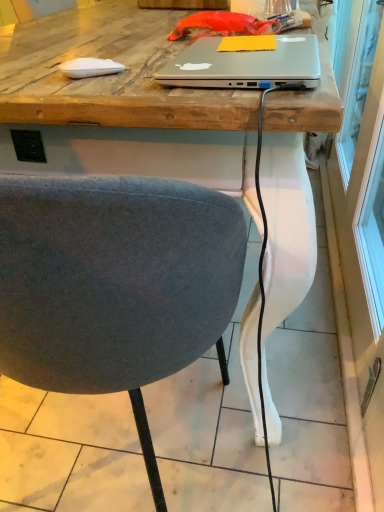
What is the approximate width of satin silver laptop at center?

The width of satin silver laptop at center is 9.12 inches.

Measure the distance between textured gray chair at center and camera.

They are 33.27 centimeters apart.

Locate an element on the screen. transparent glass screen door at right is located at coordinates (361, 234).

Can you confirm if satin silver laptop at center is smaller than transparent glass screen door at right?

Indeed, satin silver laptop at center has a smaller size compared to transparent glass screen door at right.

Does satin silver laptop at center touch transparent glass screen door at right?

No.

Considering the relative sizes of satin silver laptop at center and transparent glass screen door at right in the image provided, is satin silver laptop at center thinner than transparent glass screen door at right?

No.

Between transparent glass screen door at right and textured gray chair at center, which one has less height?

With less height is textured gray chair at center.

Which is farther, (x=368, y=317) or (x=89, y=211)?

Point (x=368, y=317)

Looking at their sizes, would you say textured gray chair at center is wider or thinner than transparent glass screen door at right?

Clearly, textured gray chair at center has more width compared to transparent glass screen door at right.

Considering the relative sizes of textured gray chair at center and transparent glass screen door at right in the image provided, is textured gray chair at center shorter than transparent glass screen door at right?

Indeed, textured gray chair at center has a lesser height compared to transparent glass screen door at right.

Which is behind, textured gray chair at center or transparent glass screen door at right?

transparent glass screen door at right is more distant.

From a real-world perspective, is textured gray chair at center above or below transparent glass screen door at right?

In terms of real-world spatial position, textured gray chair at center is below transparent glass screen door at right.

Is satin silver laptop at center not within textured gray chair at center?

No, most part of satin silver laptop at center lies within textured gray chair at center.

Does satin silver laptop at center come in front of textured gray chair at center?

No.

Consider the image. Is satin silver laptop at center taller or shorter than textured gray chair at center?

Clearly, satin silver laptop at center is shorter compared to textured gray chair at center.

From the image's perspective, which object appears higher, transparent glass screen door at right or satin silver laptop at center?

transparent glass screen door at right appears higher in the image.

Is transparent glass screen door at right far from satin silver laptop at center?

Actually, transparent glass screen door at right and satin silver laptop at center are a little close together.

Is transparent glass screen door at right wider than satin silver laptop at center?

In fact, transparent glass screen door at right might be narrower than satin silver laptop at center.

Considering the points (174, 364) and (248, 85), which point is in front, point (174, 364) or point (248, 85)?

Positioned in front is point (248, 85).

Is satin silver laptop at center a part of textured gray chair at center?

Yes, satin silver laptop at center is a part of textured gray chair at center.

Is textured gray chair at center behind satin silver laptop at center?

That is False.

Based on the photo, is textured gray chair at center looking in the opposite direction of satin silver laptop at center?

textured gray chair at center is not turned away from satin silver laptop at center.

At what (x,y) coordinates should I click in order to perform the action: click on laptop that appears above the transparent glass screen door at right (from a real-world perspective). Please return your answer as a coordinate pair (x, y). This screenshot has width=384, height=512. Looking at the image, I should click on (244, 65).

Locate an element on the screen. Image resolution: width=384 pixels, height=512 pixels. chair below the transparent glass screen door at right (from a real-world perspective) is located at coordinates (115, 285).

Estimate the real-world distances between objects in this image. Which object is closer to transparent glass screen door at right, textured gray chair at center or satin silver laptop at center?

textured gray chair at center.

Considering their positions, is satin silver laptop at center positioned further to textured gray chair at center than transparent glass screen door at right?

Among the two, transparent glass screen door at right is located further to textured gray chair at center.

Looking at the image, which one is located closer to textured gray chair at center, transparent glass screen door at right or satin silver laptop at center?

satin silver laptop at center is positioned closer to the anchor textured gray chair at center.

Which object lies nearer to the anchor point satin silver laptop at center, textured gray chair at center or transparent glass screen door at right?

Based on the image, textured gray chair at center appears to be nearer to satin silver laptop at center.

Looking at the image, which one is located closer to satin silver laptop at center, transparent glass screen door at right or textured gray chair at center?

textured gray chair at center is positioned closer to the anchor satin silver laptop at center.

Considering their positions, is satin silver laptop at center positioned further to transparent glass screen door at right than textured gray chair at center?

Among the two, satin silver laptop at center is located further to transparent glass screen door at right.

Identify the location of laptop located between textured gray chair at center and transparent glass screen door at right in the left-right direction. (244, 65).